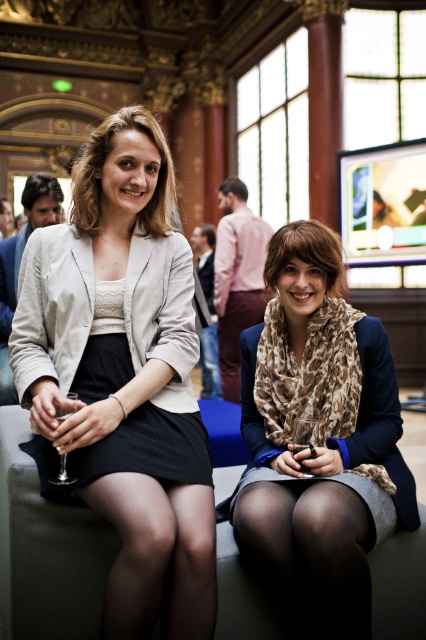
You are a photographer adjusting the camera focus. You need to ensure that both the brown hair scarf at center and the matte black hair at upper left are in focus. Which object should you adjust the focus to first to account for their size difference?

The brown hair scarf at center has a greater height compared to the matte black hair at upper left, so you should focus on the larger object first to ensure proper depth of field coverage.

You are a photographer setting up for a group photo. You need to place a microphone stand at point (123,376). However, there is already an object there. What object will the microphone stand block?

The microphone stand will block the matte beige blazer at center located at point (123,376).

You are a photographer at an event and want to capture a closeup of the matte beige blazer at center and the matte black hair at upper left. Which object should you focus on first if you want to start with the one closer to the camera?

The matte black hair at upper left is closer to the camera than the matte beige blazer at center, so focus on the matte black hair at upper left first.